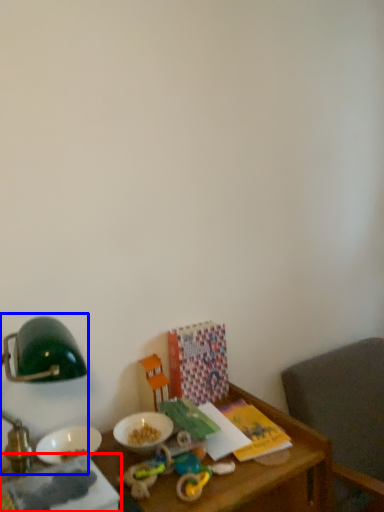
Question: Among these objects, which one is nearest to the camera, book (highlighted by a red box) or bedside lamp (highlighted by a blue box)?

Choices:
 (A) book
 (B) bedside lamp

Answer: (A)